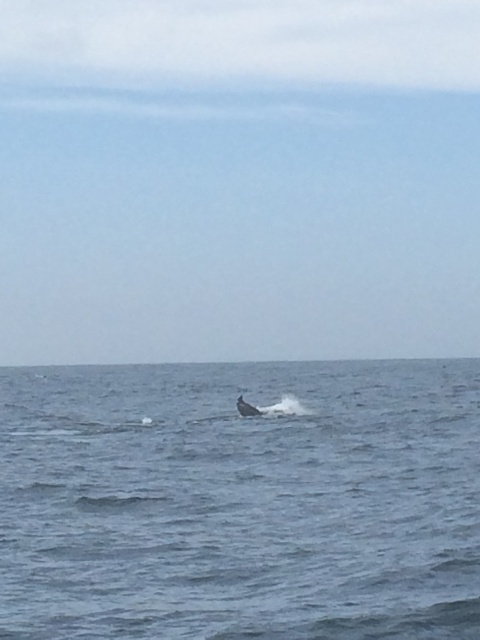
Question: Among these objects, which one is farthest from the camera?

Choices:
 (A) gray matte humpback whale at center
 (B) blue water at center

Answer: (A)

Question: Which object is closer to the camera taking this photo?

Choices:
 (A) gray matte humpback whale at center
 (B) blue water at center

Answer: (B)

Question: Does blue water at center have a greater width compared to gray matte humpback whale at center?

Choices:
 (A) no
 (B) yes

Answer: (B)

Question: Is blue water at center above gray matte humpback whale at center?

Choices:
 (A) no
 (B) yes

Answer: (A)

Question: Where is blue water at center located in relation to gray matte humpback whale at center in the image?

Choices:
 (A) below
 (B) above

Answer: (A)

Question: Which point is farther from the camera taking this photo?

Choices:
 (A) (244, 406)
 (B) (276, 547)

Answer: (A)